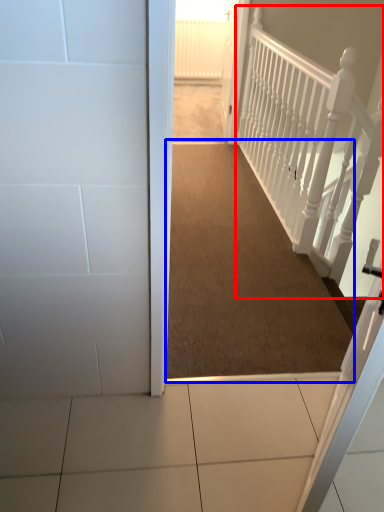
Question: Which object appears closest to the camera in this image, rail (highlighted by a red box) or corridor (highlighted by a blue box)?

Choices:
 (A) rail
 (B) corridor

Answer: (A)